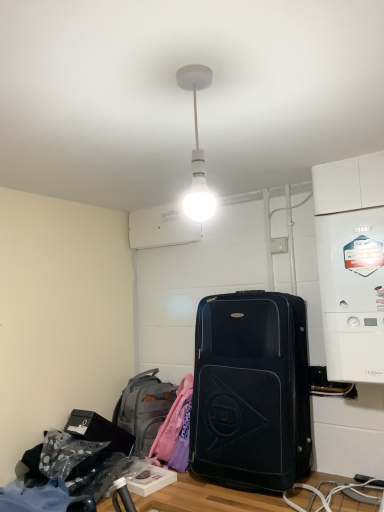
Question: Considering the relative positions of white plastic boiler at right and black fabric suitcase at center in the image provided, is white plastic boiler at right to the left or to the right of black fabric suitcase at center?

Choices:
 (A) left
 (B) right

Answer: (B)

Question: From a real-world perspective, is white plastic boiler at right physically located above or below black fabric suitcase at center?

Choices:
 (A) below
 (B) above

Answer: (B)

Question: Which is nearer to the white plastic boiler at right?

Choices:
 (A) white matte bulb at center
 (B) black fabric suitcase at center
 (C) gray fabric backpack at lower left

Answer: (B)

Question: Considering the real-world distances, which object is farthest from the gray fabric backpack at lower left?

Choices:
 (A) white matte bulb at center
 (B) black fabric suitcase at center
 (C) white plastic boiler at right

Answer: (A)